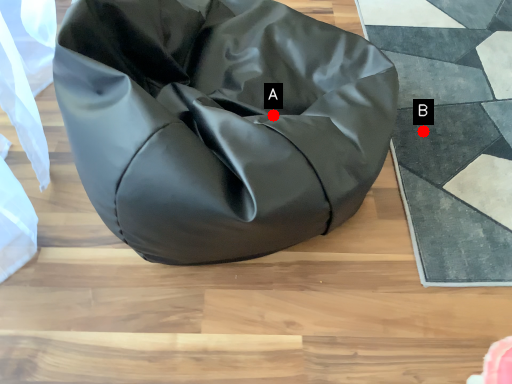
Question: Two points are circled on the image, labeled by A and B beside each circle. Which point is closer to the camera?

Choices:
 (A) A is closer
 (B) B is closer

Answer: (A)